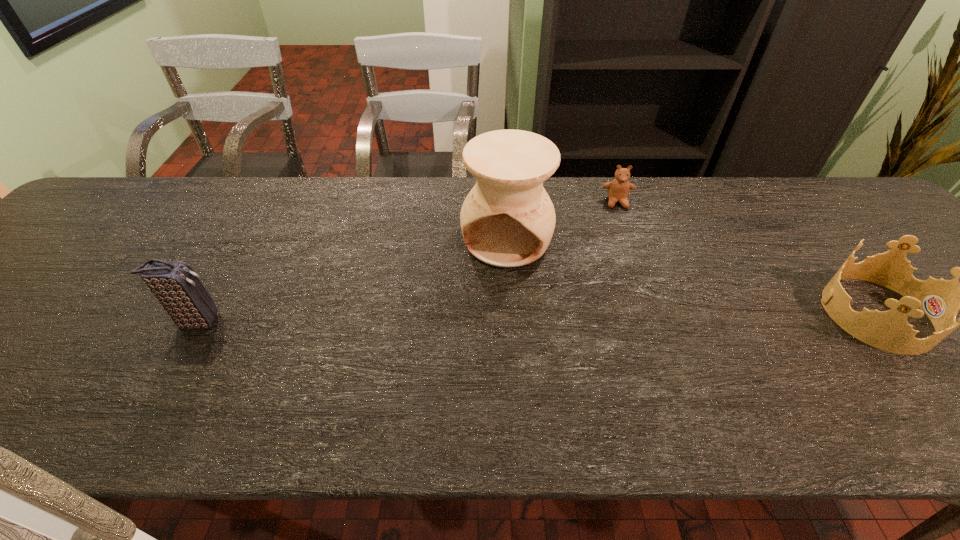
Where is `the second tallest object`? the second tallest object is located at coordinates (177, 287).

The image size is (960, 540). I want to click on the leftmost object, so click(177, 287).

Identify the location of the third nearest object. The width and height of the screenshot is (960, 540). (507, 220).

Where is `the tallest object`? the tallest object is located at coordinates (507, 220).

In order to click on the second object from right to left in this screenshot , I will do `click(618, 189)`.

What are the coordinates of `the shortest object` in the screenshot? It's located at (618, 189).

Identify the location of free space located 0.110m with the zip open on the leftmost object. (273, 321).

This screenshot has width=960, height=540. What are the coordinates of `vacant space located at the open side of the pottery` in the screenshot? It's located at (483, 346).

Locate an element on the screen. vacant space situated at the open side of the pottery is located at coordinates (482, 349).

This screenshot has height=540, width=960. Identify the location of vacant space located 0.100m at the open side of the pottery. (492, 300).